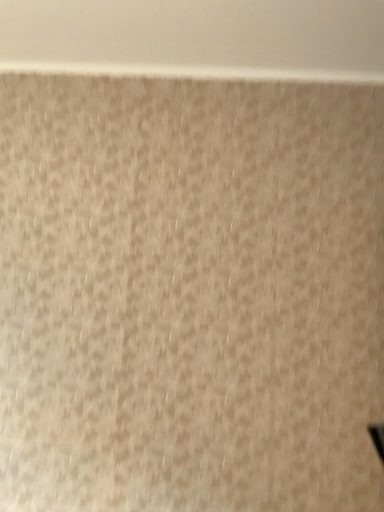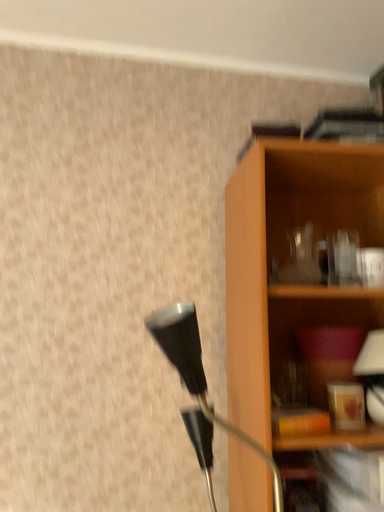
Question: Which way did the camera rotate in the video?

Choices:
 (A) rotated right
 (B) rotated left

Answer: (A)